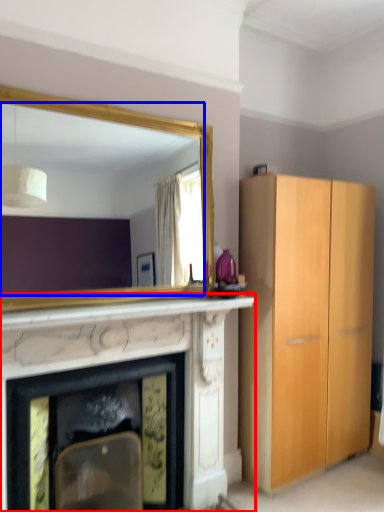
Question: Which object is further to the camera taking this photo, fireplace (highlighted by a red box) or mirror (highlighted by a blue box)?

Choices:
 (A) fireplace
 (B) mirror

Answer: (B)